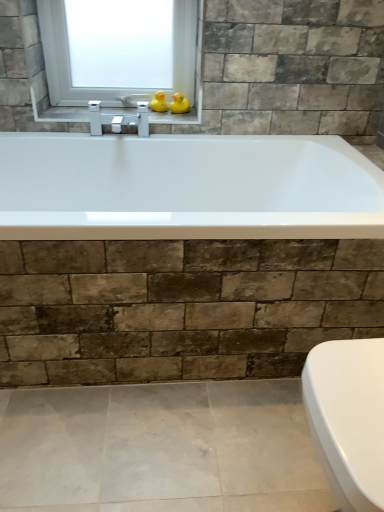
Measure the distance between metallic silver faucet at upper center and camera.

They are 5.32 feet apart.

The height and width of the screenshot is (512, 384). What do you see at coordinates (179, 104) in the screenshot?
I see `yellow rubber duck at upper center, positioned as the 1th duck in right-to-left order` at bounding box center [179, 104].

Where is `transparent glass window at upper center`? The image size is (384, 512). transparent glass window at upper center is located at coordinates (120, 50).

You are a GUI agent. You are given a task and a screenshot of the screen. Output one action in this format:
    pyautogui.click(x=<x>, y=<y>)
    Task: Click on the metallic silver faucet at upper center
    
    Given the screenshot: What is the action you would take?
    pyautogui.click(x=59, y=112)

From the picture: Is transparent glass window at upper center not inside rubber duck at upper center, which is the second duck in right-to-left order?

That's correct, transparent glass window at upper center is outside of rubber duck at upper center, which is the second duck in right-to-left order.

Is there a large distance between transparent glass window at upper center and rubber duck at upper center, the first duck in the left-to-right sequence?

That's not correct — transparent glass window at upper center is a little close to rubber duck at upper center, the first duck in the left-to-right sequence.

Considering the positions of objects transparent glass window at upper center and rubber duck at upper center, the first duck in the left-to-right sequence, in the image provided, who is more to the left, transparent glass window at upper center or rubber duck at upper center, the first duck in the left-to-right sequence,?

transparent glass window at upper center.

Is point (115, 23) less distant than point (159, 95)?

Yes, it is in front of point (159, 95).

How far apart are metallic silver faucet at upper center and yellow rubber duck at upper center, which is counted as the second duck, starting from the left?

They are 8.93 inches apart.

Between point (199, 89) and point (179, 96), which one is positioned in front?

The point (199, 89) is in front.

Which object is positioned more to the left, metallic silver faucet at upper center or yellow rubber duck at upper center, positioned as the 1th duck in right-to-left order?

From the viewer's perspective, metallic silver faucet at upper center appears more on the left side.

The width and height of the screenshot is (384, 512). I want to click on window sill in front of the yellow rubber duck at upper center, which is counted as the second duck, starting from the left, so click(59, 112).

Which object is closer to the camera, transparent glass window at upper center or yellow rubber duck at upper center, which is counted as the second duck, starting from the left?

transparent glass window at upper center is more forward.

Between point (91, 73) and point (178, 112), which one is positioned behind?

The point (91, 73) is farther.

What are the coordinates of `window that is above the yellow rubber duck at upper center, positioned as the 1th duck in right-to-left order (from a real-world perspective)` in the screenshot? It's located at (120, 50).

Could you tell me if transparent glass window at upper center is facing yellow rubber duck at upper center, which is counted as the second duck, starting from the left?

Yes, transparent glass window at upper center is oriented towards yellow rubber duck at upper center, which is counted as the second duck, starting from the left.

Is metallic silver faucet at upper center oriented away from transparent glass window at upper center?

Absolutely, metallic silver faucet at upper center is directed away from transparent glass window at upper center.

Is metallic silver faucet at upper center taller than transparent glass window at upper center?

In fact, metallic silver faucet at upper center may be shorter than transparent glass window at upper center.

From a real-world perspective, is metallic silver faucet at upper center on transparent glass window at upper center?

Incorrect, from a real-world perspective, metallic silver faucet at upper center is lower than transparent glass window at upper center.

Considering the points (88, 119) and (153, 21), which point is in front, point (88, 119) or point (153, 21)?

Positioned in front is point (88, 119).

From the picture: Which is further, (187, 101) or (161, 101)?

Point (187, 101)

From a real-world perspective, which is physically below, yellow rubber duck at upper center, which is counted as the second duck, starting from the left, or rubber duck at upper center, the first duck in the left-to-right sequence?

From a 3D spatial view, rubber duck at upper center, the first duck in the left-to-right sequence, is below.

Is yellow rubber duck at upper center, which is counted as the second duck, starting from the left, facing towards rubber duck at upper center, the first duck in the left-to-right sequence?

No.

From the picture: Does yellow rubber duck at upper center, positioned as the 1th duck in right-to-left order, have a lesser width compared to rubber duck at upper center, the first duck in the left-to-right sequence?

Correct, the width of yellow rubber duck at upper center, positioned as the 1th duck in right-to-left order, is less than that of rubber duck at upper center, the first duck in the left-to-right sequence.

Measure the distance between rubber duck at upper center, which is the second duck in right-to-left order, and yellow rubber duck at upper center, positioned as the 1th duck in right-to-left order.

rubber duck at upper center, which is the second duck in right-to-left order, is 2.09 inches away from yellow rubber duck at upper center, positioned as the 1th duck in right-to-left order.

From the image's perspective, is rubber duck at upper center, the first duck in the left-to-right sequence, above yellow rubber duck at upper center, which is counted as the second duck, starting from the left?

Yes, from the image's perspective, rubber duck at upper center, the first duck in the left-to-right sequence, is on top of yellow rubber duck at upper center, which is counted as the second duck, starting from the left.

I want to click on duck that appears in front of the rubber duck at upper center, which is the second duck in right-to-left order, so click(x=179, y=104).

Does rubber duck at upper center, the first duck in the left-to-right sequence, have a greater height compared to yellow rubber duck at upper center, positioned as the 1th duck in right-to-left order?

Correct, rubber duck at upper center, the first duck in the left-to-right sequence, is much taller as yellow rubber duck at upper center, positioned as the 1th duck in right-to-left order.

From the image's perspective, is yellow rubber duck at upper center, which is counted as the second duck, starting from the left, under metallic silver faucet at upper center?

No, from the image's perspective, yellow rubber duck at upper center, which is counted as the second duck, starting from the left, is not beneath metallic silver faucet at upper center.

Which object is wider, yellow rubber duck at upper center, positioned as the 1th duck in right-to-left order, or metallic silver faucet at upper center?

With larger width is metallic silver faucet at upper center.

Can you tell me how much yellow rubber duck at upper center, which is counted as the second duck, starting from the left, and metallic silver faucet at upper center differ in facing direction?

There is a 3.77-degree angle between the facing directions of yellow rubber duck at upper center, which is counted as the second duck, starting from the left, and metallic silver faucet at upper center.

Find the location of `window sill on the left of yellow rubber duck at upper center, positioned as the 1th duck in right-to-left order`. window sill on the left of yellow rubber duck at upper center, positioned as the 1th duck in right-to-left order is located at coordinates (59, 112).

You are a GUI agent. You are given a task and a screenshot of the screen. Output one action in this format:
    pyautogui.click(x=<x>, y=<y>)
    Task: Click on the window on the left of the rubber duck at upper center, which is the second duck in right-to-left order
    This screenshot has height=512, width=384.
    Given the screenshot: What is the action you would take?
    click(120, 50)

The width and height of the screenshot is (384, 512). What are the coordinates of `window sill below the yellow rubber duck at upper center, which is counted as the second duck, starting from the left (from a real-world perspective)` in the screenshot? It's located at (59, 112).

Which object lies further to the anchor point yellow rubber duck at upper center, positioned as the 1th duck in right-to-left order, rubber duck at upper center, the first duck in the left-to-right sequence, or transparent glass window at upper center?

transparent glass window at upper center is further to yellow rubber duck at upper center, positioned as the 1th duck in right-to-left order.

Estimate the real-world distances between objects in this image. Which object is further from transparent glass window at upper center, yellow rubber duck at upper center, positioned as the 1th duck in right-to-left order, or rubber duck at upper center, which is the second duck in right-to-left order?

yellow rubber duck at upper center, positioned as the 1th duck in right-to-left order.

Which object lies nearer to the anchor point rubber duck at upper center, the first duck in the left-to-right sequence, metallic silver faucet at upper center or transparent glass window at upper center?

Among the two, metallic silver faucet at upper center is located nearer to rubber duck at upper center, the first duck in the left-to-right sequence.

Considering their positions, is yellow rubber duck at upper center, which is counted as the second duck, starting from the left, positioned further to metallic silver faucet at upper center than rubber duck at upper center, the first duck in the left-to-right sequence?

yellow rubber duck at upper center, which is counted as the second duck, starting from the left, is further to metallic silver faucet at upper center.

Based on their spatial positions, is transparent glass window at upper center or yellow rubber duck at upper center, which is counted as the second duck, starting from the left, closer to metallic silver faucet at upper center?

Based on the image, transparent glass window at upper center appears to be nearer to metallic silver faucet at upper center.

From the image, which object appears to be nearer to yellow rubber duck at upper center, which is counted as the second duck, starting from the left, transparent glass window at upper center or metallic silver faucet at upper center?

metallic silver faucet at upper center.

From the image, which object appears to be nearer to transparent glass window at upper center, metallic silver faucet at upper center or rubber duck at upper center, which is the second duck in right-to-left order?

metallic silver faucet at upper center lies closer to transparent glass window at upper center than the other object.

When comparing their distances from rubber duck at upper center, the first duck in the left-to-right sequence, does transparent glass window at upper center or metallic silver faucet at upper center seem further?

transparent glass window at upper center.

You are a GUI agent. You are given a task and a screenshot of the screen. Output one action in this format:
    pyautogui.click(x=<x>, y=<y>)
    Task: Click on the window sill located between transparent glass window at upper center and yellow rubber duck at upper center, positioned as the 1th duck in right-to-left order, in the left-right direction
    
    Given the screenshot: What is the action you would take?
    (59, 112)

Where is `duck located between transparent glass window at upper center and yellow rubber duck at upper center, positioned as the 1th duck in right-to-left order, in the left-right direction`? This screenshot has width=384, height=512. duck located between transparent glass window at upper center and yellow rubber duck at upper center, positioned as the 1th duck in right-to-left order, in the left-right direction is located at coordinates (159, 102).

Find the location of a particular element. This screenshot has width=384, height=512. duck between metallic silver faucet at upper center and yellow rubber duck at upper center, positioned as the 1th duck in right-to-left order, in the horizontal direction is located at coordinates (159, 102).